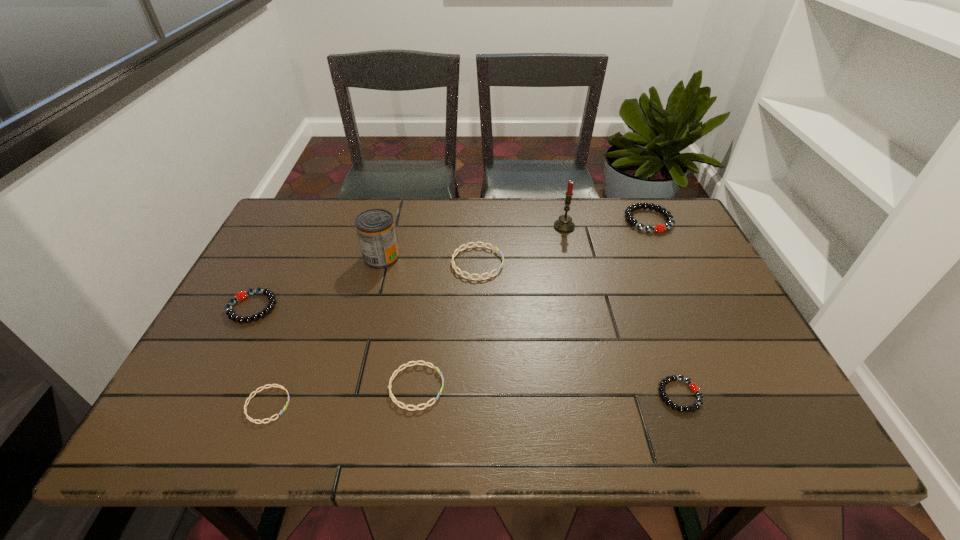
Locate which blue bracelet ranks in proximity to the smallest blue bracelet. Please provide its 2D coordinates. Your answer should be formatted as a tuple, i.e. [(x, y)], where the tuple contains the x and y coordinates of a point satisfying the conditions above.

[(394, 400)]

Image resolution: width=960 pixels, height=540 pixels. I want to click on vacant area in the image that satisfies the following two spatial constraints: 1. on the front side of the second smallest black bracelet; 2. on the right side of the smallest black bracelet, so click(207, 395).

The image size is (960, 540). I want to click on blank area in the image that satisfies the following two spatial constraints: 1. on the back side of the seventh shortest object; 2. on the right side of the leftmost object, so click(x=278, y=257).

This screenshot has height=540, width=960. Identify the location of free point that satisfies the following two spatial constraints: 1. on the surface of the second biggest blue bracelet showing star-shaped elements; 2. on the left side of the smallest black bracelet. (416, 395).

Identify the location of vacant area that satisfies the following two spatial constraints: 1. on the front side of the farthest bracelet; 2. on the surface of the fifth nearest bracelet showing star-shaped elements. (668, 263).